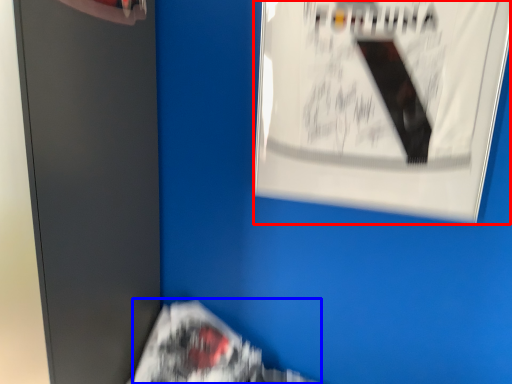
Question: Which object is further to the camera taking this photo, poster (highlighted by a red box) or flyer (highlighted by a blue box)?

Choices:
 (A) poster
 (B) flyer

Answer: (B)